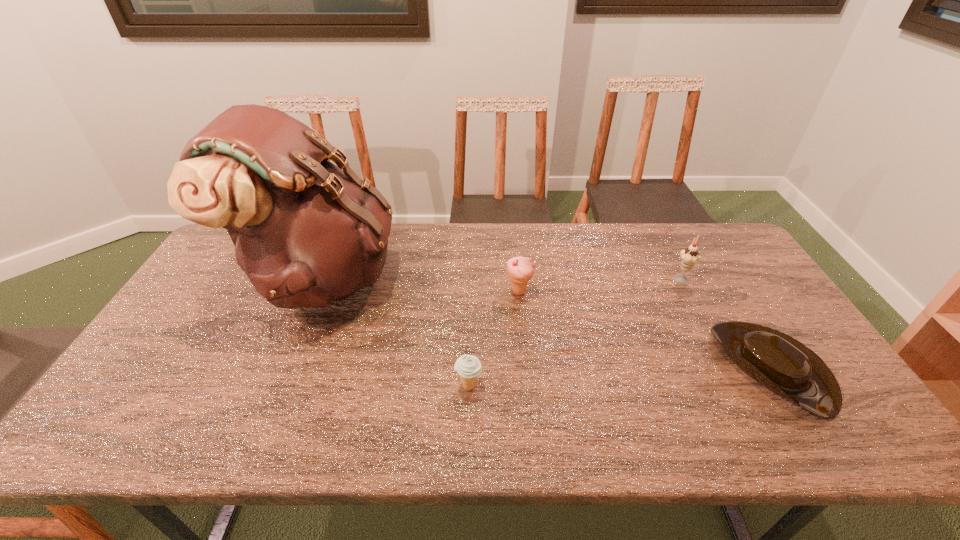
Where is `blank area in the image that satisfies the following two spatial constraints: 1. at the front of the satchel with buckles; 2. on the right side of the third object from right to left`? blank area in the image that satisfies the following two spatial constraints: 1. at the front of the satchel with buckles; 2. on the right side of the third object from right to left is located at coordinates (317, 292).

This screenshot has width=960, height=540. What are the coordinates of `free point that satisfies the following two spatial constraints: 1. at the front of the rightmost icecream with buckles; 2. on the left side of the tallest object` in the screenshot? It's located at (323, 278).

Identify the location of free space that satisfies the following two spatial constraints: 1. at the front of the third object from left to right with buckles; 2. on the right side of the leftmost object. (317, 292).